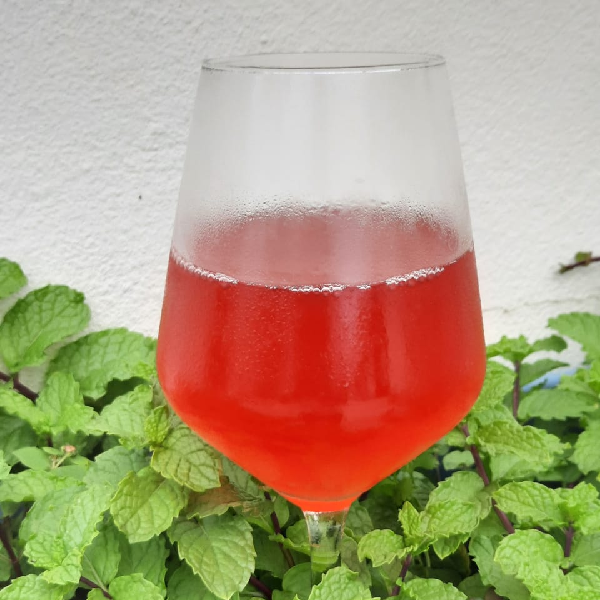
Where is `top left of white wall`? Image resolution: width=600 pixels, height=600 pixels. top left of white wall is located at coordinates click(x=12, y=11).